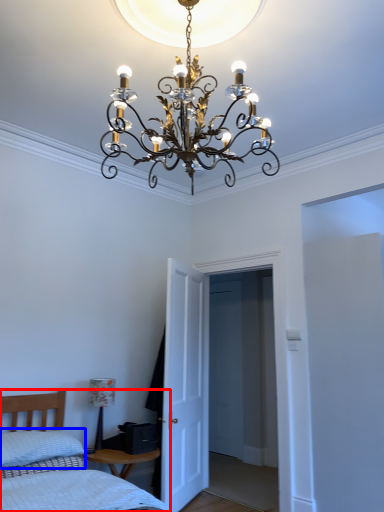
Question: Which object appears farthest to the camera in this image, bed (highlighted by a red box) or pillow (highlighted by a blue box)?

Choices:
 (A) bed
 (B) pillow

Answer: (B)